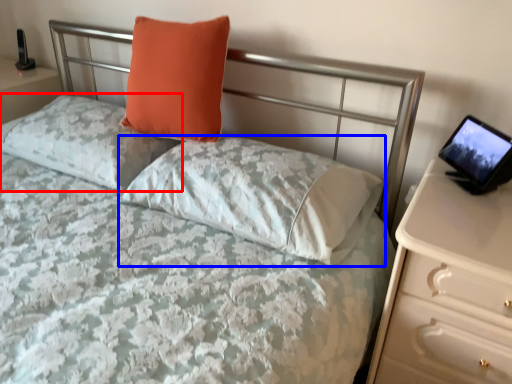
Question: Among these objects, which one is nearest to the camera, pillow (highlighted by a red box) or pillow (highlighted by a blue box)?

Choices:
 (A) pillow
 (B) pillow

Answer: (B)